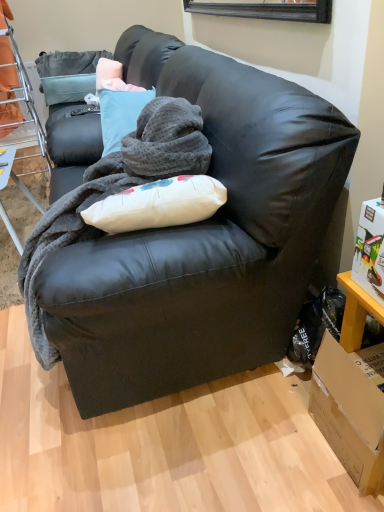
Question: Is orange fabric bunk bed at left thinner than metal mesh table at lower left?

Choices:
 (A) no
 (B) yes

Answer: (A)

Question: Is the position of orange fabric bunk bed at left more distant than that of metal mesh table at lower left?

Choices:
 (A) yes
 (B) no

Answer: (A)

Question: Can we say orange fabric bunk bed at left lies outside metal mesh table at lower left?

Choices:
 (A) no
 (B) yes

Answer: (B)

Question: From the image's perspective, is orange fabric bunk bed at left on metal mesh table at lower left?

Choices:
 (A) yes
 (B) no

Answer: (A)

Question: Considering the relative sizes of orange fabric bunk bed at left and metal mesh table at lower left in the image provided, is orange fabric bunk bed at left smaller than metal mesh table at lower left?

Choices:
 (A) yes
 (B) no

Answer: (B)

Question: Based on their sizes in the image, would you say metal mesh table at lower left is bigger or smaller than matte black couch at center?

Choices:
 (A) big
 (B) small

Answer: (B)

Question: Relative to matte black couch at center, is metal mesh table at lower left in front or behind?

Choices:
 (A) front
 (B) behind

Answer: (B)

Question: In terms of width, does metal mesh table at lower left look wider or thinner when compared to matte black couch at center?

Choices:
 (A) wide
 (B) thin

Answer: (B)

Question: From a real-world perspective, relative to matte black couch at center, is metal mesh table at lower left vertically above or below?

Choices:
 (A) below
 (B) above

Answer: (A)

Question: From the image's perspective, is metal mesh table at lower left located above or below soft gray fleece blanket at center?

Choices:
 (A) below
 (B) above

Answer: (B)

Question: Considering the positions of metal mesh table at lower left and soft gray fleece blanket at center in the image, is metal mesh table at lower left bigger or smaller than soft gray fleece blanket at center?

Choices:
 (A) small
 (B) big

Answer: (A)

Question: Considering their positions, is metal mesh table at lower left located in front of or behind soft gray fleece blanket at center?

Choices:
 (A) behind
 (B) front

Answer: (A)

Question: Considering the positions of metal mesh table at lower left and soft gray fleece blanket at center in the image, is metal mesh table at lower left taller or shorter than soft gray fleece blanket at center?

Choices:
 (A) short
 (B) tall

Answer: (A)

Question: From the image's perspective, is matte black couch at center positioned above or below brown cardboard box at lower right?

Choices:
 (A) above
 (B) below

Answer: (A)

Question: Would you say matte black couch at center is inside or outside brown cardboard box at lower right?

Choices:
 (A) inside
 (B) outside

Answer: (B)